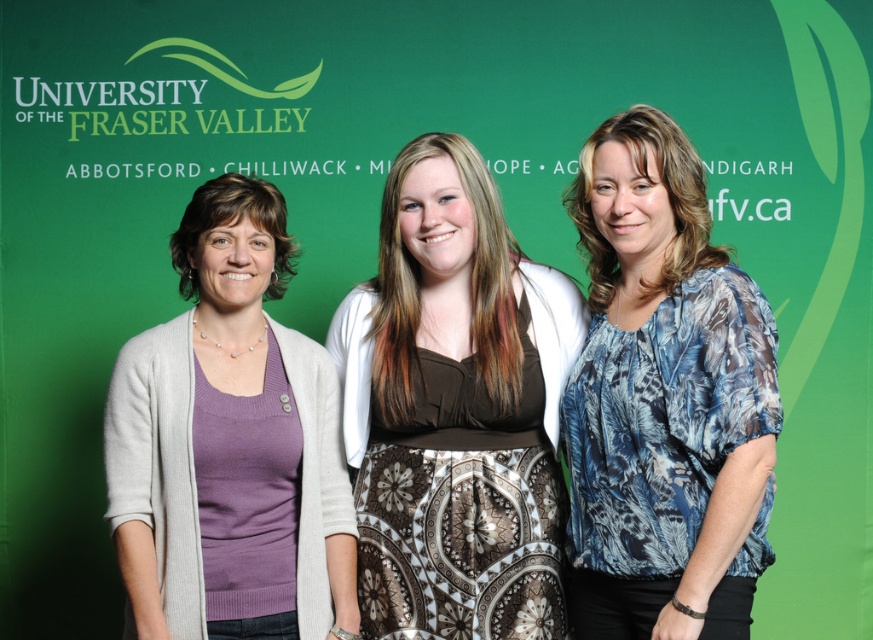
Between brown satin dress at center and blue printed blouse at center, which one is positioned higher?

blue printed blouse at center is above.

Is point (418, 280) less distant than point (650, 528)?

No, (418, 280) is behind (650, 528).

Identify the location of brown satin dress at center. (455, 410).

Is blue printed blouse at center smaller than purple knit sweater at left?

No, blue printed blouse at center is not smaller than purple knit sweater at left.

Between blue printed blouse at center and purple knit sweater at left, which one has more height?

With more height is blue printed blouse at center.

Where is `blue printed blouse at center`? This screenshot has height=640, width=873. blue printed blouse at center is located at coordinates (664, 400).

Who is higher up, brown satin dress at center or purple knit sweater at left?

Positioned higher is brown satin dress at center.

Who is taller, brown satin dress at center or purple knit sweater at left?

Standing taller between the two is brown satin dress at center.

Which is behind, point (361, 436) or point (191, 230)?

Point (361, 436)

Identify the location of brown satin dress at center. (455, 410).